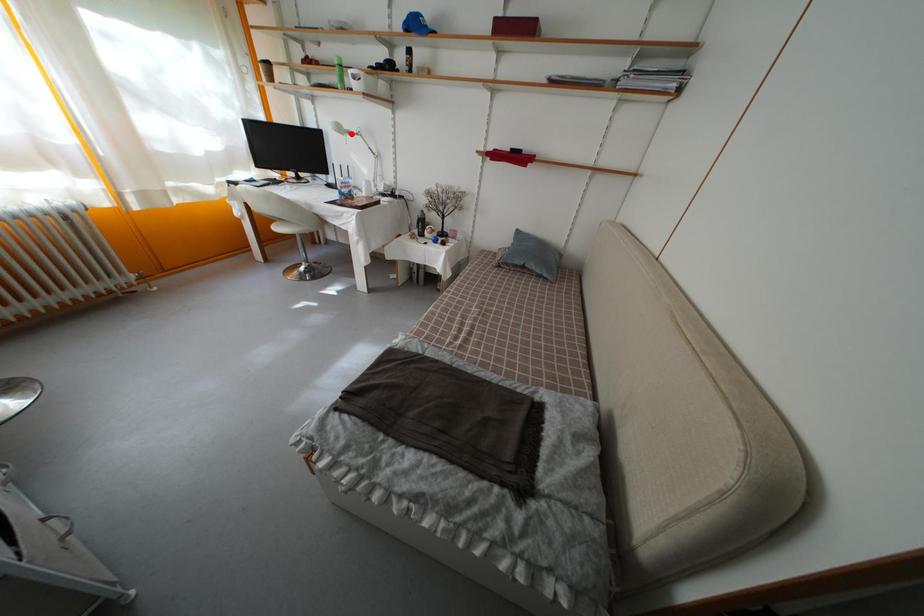
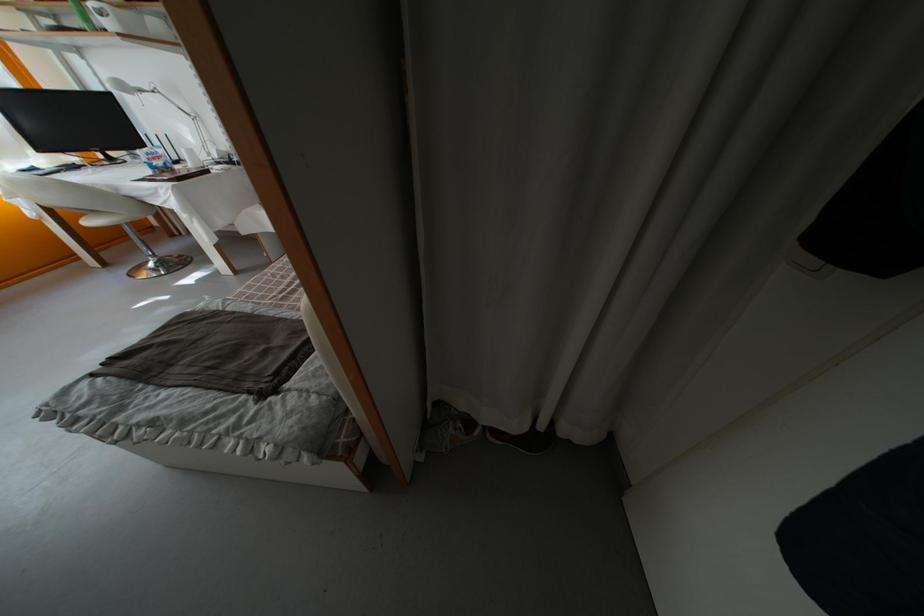
Question: I am providing you with two images of the same scene from different viewpoints. Image1 has a red point marked. In image2, the corresponding 3D location appears at what relative position? Reply with the corresponding letter.

Choices:
 (A) Closer
 (B) Farther

Answer: (B)